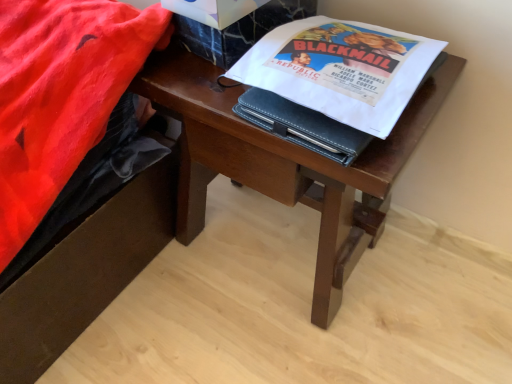
This screenshot has height=384, width=512. What are the coordinates of `vacant space in front of wooden desk at center` in the screenshot? It's located at (290, 345).